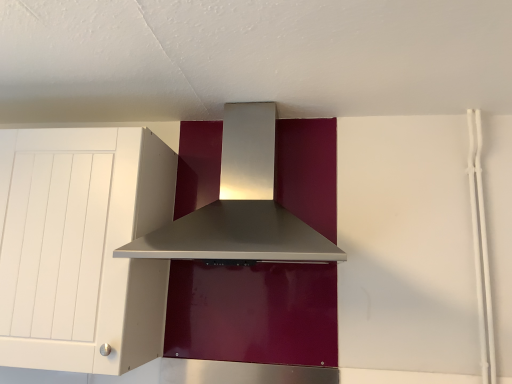
The height and width of the screenshot is (384, 512). Identify the location of free space above satin silver range hood at center (from a real-world perspective). (246, 88).